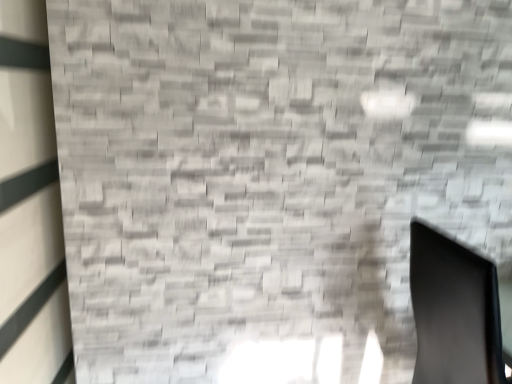
In order to click on black matte swivel chair at lower right in this screenshot , I will do `click(454, 311)`.

Describe the element at coordinates (454, 311) in the screenshot. The image size is (512, 384). I see `black matte swivel chair at lower right` at that location.

Describe the element at coordinates (30, 207) in the screenshot. I see `matte gray brick wall at left` at that location.

You are a GUI agent. You are given a task and a screenshot of the screen. Output one action in this format:
    pyautogui.click(x=<x>, y=<y>)
    Task: Click on the matte gray brick wall at left
    The height and width of the screenshot is (384, 512).
    Given the screenshot: What is the action you would take?
    pyautogui.click(x=30, y=207)

Where is `black matte swivel chair at lower right`? This screenshot has width=512, height=384. black matte swivel chair at lower right is located at coordinates (454, 311).

Is black matte swivel chair at lower right at the right side of matte gray brick wall at left?

Yes, black matte swivel chair at lower right is to the right of matte gray brick wall at left.

Is black matte swivel chair at lower right in front of or behind matte gray brick wall at left in the image?

In the image, black matte swivel chair at lower right appears behind matte gray brick wall at left.

Is point (419, 246) positioned before point (8, 55)?

No, (419, 246) is further to viewer.

From the image's perspective, does black matte swivel chair at lower right appear lower than matte gray brick wall at left?

Indeed, from the image's perspective, black matte swivel chair at lower right is shown beneath matte gray brick wall at left.

From a real-world perspective, is black matte swivel chair at lower right on matte gray brick wall at left?

No, from a real-world perspective, black matte swivel chair at lower right is not above matte gray brick wall at left.

Can you confirm if black matte swivel chair at lower right is thinner than matte gray brick wall at left?

Incorrect, the width of black matte swivel chair at lower right is not less than that of matte gray brick wall at left.

Which of these two, black matte swivel chair at lower right or matte gray brick wall at left, stands taller?

matte gray brick wall at left is taller.

Considering the relative sizes of black matte swivel chair at lower right and matte gray brick wall at left in the image provided, is black matte swivel chair at lower right smaller than matte gray brick wall at left?

No, black matte swivel chair at lower right is not smaller than matte gray brick wall at left.

Is matte gray brick wall at left inside black matte swivel chair at lower right?

No, matte gray brick wall at left is not a part of black matte swivel chair at lower right.

Can you see black matte swivel chair at lower right touching matte gray brick wall at left?

No, black matte swivel chair at lower right is not next to matte gray brick wall at left.

Is black matte swivel chair at lower right positioned with its back to matte gray brick wall at left?

Absolutely, black matte swivel chair at lower right is directed away from matte gray brick wall at left.

Where is `swivel chair below the matte gray brick wall at left (from a real-world perspective)`? The image size is (512, 384). swivel chair below the matte gray brick wall at left (from a real-world perspective) is located at coordinates (454, 311).

In the image, is matte gray brick wall at left on the left side or the right side of black matte swivel chair at lower right?

Clearly, matte gray brick wall at left is on the left of black matte swivel chair at lower right in the image.

Is matte gray brick wall at left in front of black matte swivel chair at lower right?

That is True.

Is point (12, 304) positioned behind point (450, 357)?

No, (12, 304) is in front of (450, 357).

From the image's perspective, would you say matte gray brick wall at left is shown under black matte swivel chair at lower right?

No, from the image's perspective, matte gray brick wall at left is not below black matte swivel chair at lower right.

From a real-world perspective, is matte gray brick wall at left over black matte swivel chair at lower right?

Yes, from a real-world perspective, matte gray brick wall at left is above black matte swivel chair at lower right.

Considering the relative sizes of matte gray brick wall at left and black matte swivel chair at lower right in the image provided, is matte gray brick wall at left wider than black matte swivel chair at lower right?

No.

Is matte gray brick wall at left shorter than black matte swivel chair at lower right?

No.

Who is smaller, matte gray brick wall at left or black matte swivel chair at lower right?

matte gray brick wall at left.

Would you say matte gray brick wall at left is outside black matte swivel chair at lower right?

Absolutely, matte gray brick wall at left is external to black matte swivel chair at lower right.

Is matte gray brick wall at left far away from black matte swivel chair at lower right?

Yes, matte gray brick wall at left and black matte swivel chair at lower right are quite far apart.

Is matte gray brick wall at left turned away from black matte swivel chair at lower right?

That's right, matte gray brick wall at left is facing away from black matte swivel chair at lower right.

Image resolution: width=512 pixels, height=384 pixels. Identify the location of swivel chair that appears on the right of matte gray brick wall at left. (454, 311).

This screenshot has width=512, height=384. Identify the location of swivel chair that is behind the matte gray brick wall at left. (454, 311).

At what (x,y) coordinates should I click in order to perform the action: click on swivel chair below the matte gray brick wall at left (from a real-world perspective). Please return your answer as a coordinate pair (x, y). The image size is (512, 384). Looking at the image, I should click on (454, 311).